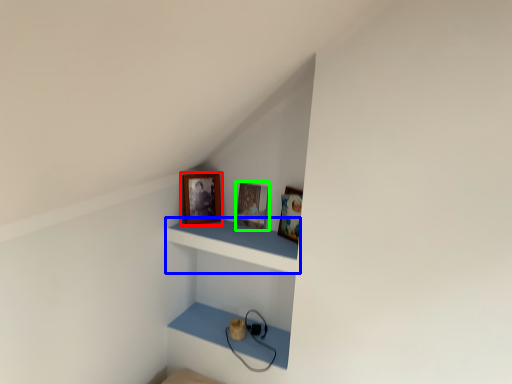
Question: Which object is positioned closest to picture frame (highlighted by a red box)? Select from shelf (highlighted by a blue box) and picture frame (highlighted by a green box).

Choices:
 (A) shelf
 (B) picture frame

Answer: (B)